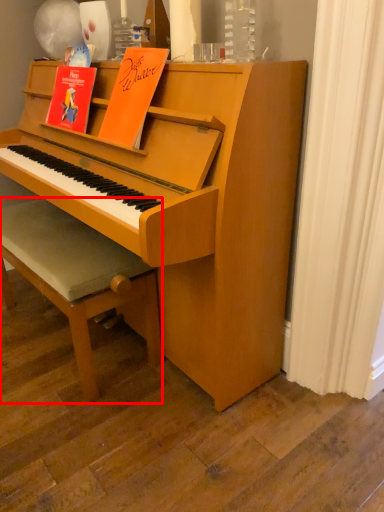
Question: From the image's perspective, considering the relative positions of footrest (annotated by the red box) and paperback book in the image provided, where is footrest (annotated by the red box) located with respect to the staircase?

Choices:
 (A) above
 (B) below

Answer: (B)